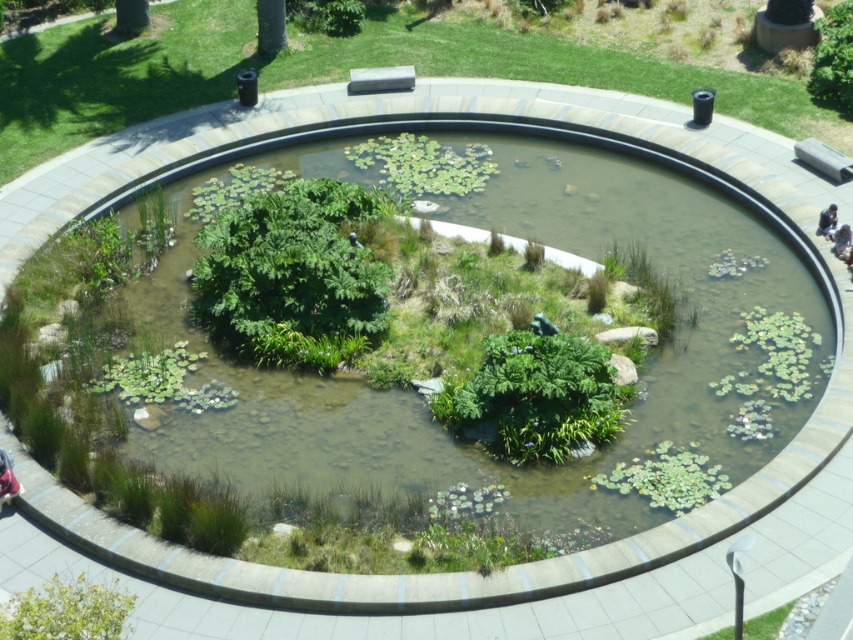
Question: From the image, what is the correct spatial relationship of green leafy pond at center in relation to fluffy pink jacket at bottom left?

Choices:
 (A) right
 (B) left

Answer: (A)

Question: Among these points, which one is farthest from the camera?

Choices:
 (A) (140, 12)
 (B) (840, 237)

Answer: (A)

Question: Is green leafy pond at center bigger than green leafy tree at upper left?

Choices:
 (A) no
 (B) yes

Answer: (B)

Question: Which point appears farthest from the camera in this image?

Choices:
 (A) tap(282, 22)
 (B) tap(833, 220)
 (C) tap(836, 236)

Answer: (A)

Question: Does dark blue fabric at upper right have a greater width compared to light brown wooden bench at lower right?

Choices:
 (A) yes
 (B) no

Answer: (A)

Question: Estimate the real-world distances between objects in this image. Which object is farther from the green leafy pond at center?

Choices:
 (A) light brown wooden bench at lower right
 (B) green leafy tree at upper center

Answer: (B)